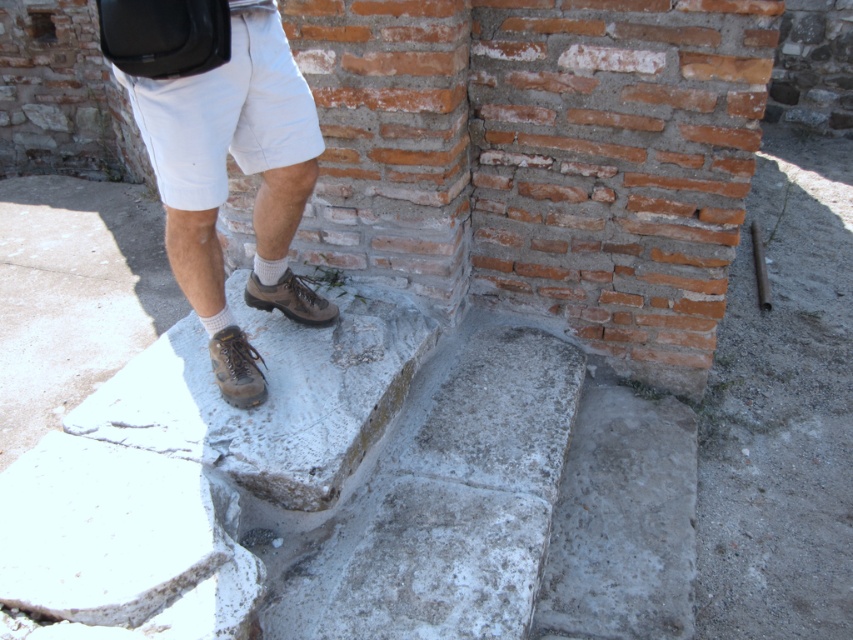
Does brown leather shoes at lower center come in front of white cotton shorts at upper left?

Yes, brown leather shoes at lower center is closer to the viewer.

Which of these two, brown leather shoes at lower center or white cotton shorts at upper left, stands taller?

Standing taller between the two is brown leather shoes at lower center.

Which is behind, point (200, 160) or point (270, 54)?

Positioned behind is point (270, 54).

The image size is (853, 640). Identify the location of brown leather shoes at lower center. (225, 180).

Between brown leather boot at center and brown suede shoe at center, which one is positioned lower?

brown leather boot at center

Is brown leather boot at center below brown suede shoe at center?

Correct, brown leather boot at center is located below brown suede shoe at center.

Find the location of a particular element. This screenshot has width=853, height=640. brown leather boot at center is located at coordinates (236, 368).

At what (x,y) coordinates should I click in order to perform the action: click on brown leather boot at center. Please return your answer as a coordinate pair (x, y). Looking at the image, I should click on (236, 368).

Does white cotton shorts at upper left have a greater height compared to brown suede shoe at center?

Correct, white cotton shorts at upper left is much taller as brown suede shoe at center.

Does point (254, 113) come farther from viewer compared to point (328, 324)?

That is False.

The image size is (853, 640). I want to click on white cotton shorts at upper left, so click(x=225, y=113).